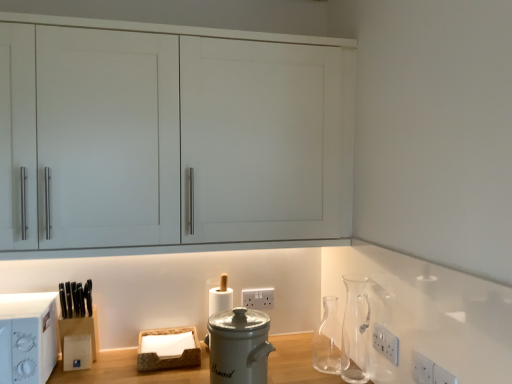
Question: Is transparent glass carafe at right turned away from white plastic microwave at left?

Choices:
 (A) yes
 (B) no

Answer: (B)

Question: From a real-world perspective, is transparent glass carafe at right located higher than white plastic microwave at left?

Choices:
 (A) no
 (B) yes

Answer: (B)

Question: Can you confirm if transparent glass carafe at right is shorter than white plastic microwave at left?

Choices:
 (A) no
 (B) yes

Answer: (A)

Question: Can you confirm if transparent glass carafe at right is positioned to the left of white plastic microwave at left?

Choices:
 (A) yes
 (B) no

Answer: (B)

Question: Is transparent glass carafe at right behind white plastic microwave at left?

Choices:
 (A) yes
 (B) no

Answer: (A)

Question: Does transparent glass carafe at right appear on the right side of white plastic microwave at left?

Choices:
 (A) no
 (B) yes

Answer: (B)

Question: Is transparent glass carafe at center-right next to white ceramic bread bin at center and touching it?

Choices:
 (A) yes
 (B) no

Answer: (B)

Question: Is transparent glass carafe at center-right oriented away from white ceramic bread bin at center?

Choices:
 (A) yes
 (B) no

Answer: (B)

Question: Does transparent glass carafe at center-right have a lesser height compared to white ceramic bread bin at center?

Choices:
 (A) yes
 (B) no

Answer: (A)

Question: Can you confirm if transparent glass carafe at center-right is thinner than white ceramic bread bin at center?

Choices:
 (A) no
 (B) yes

Answer: (B)

Question: From a real-world perspective, is transparent glass carafe at center-right below white ceramic bread bin at center?

Choices:
 (A) yes
 (B) no

Answer: (A)

Question: Considering the relative positions of transparent glass carafe at center-right and white ceramic bread bin at center in the image provided, is transparent glass carafe at center-right to the left of white ceramic bread bin at center from the viewer's perspective?

Choices:
 (A) yes
 (B) no

Answer: (B)

Question: Is white plastic electric outlet at lower right, which is counted as the 1th electric outlet, starting from the front, outside white plastic microwave at left?

Choices:
 (A) no
 (B) yes

Answer: (B)